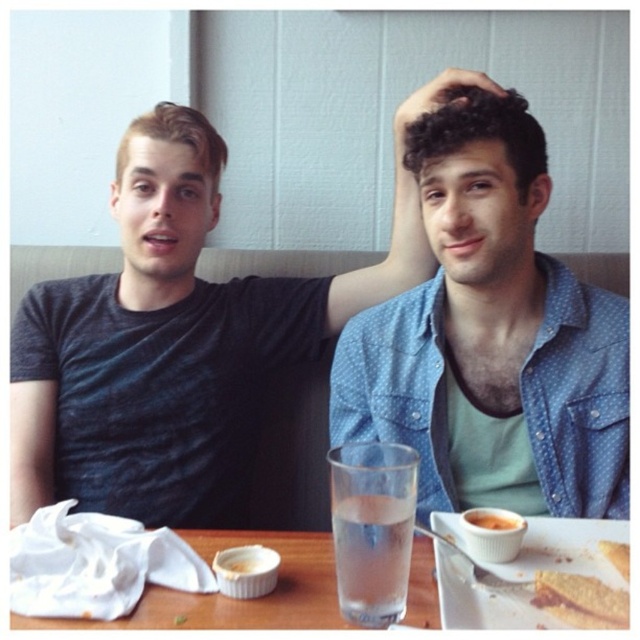
Between point (604, 586) and point (620, 561), which one is positioned in front?

Point (604, 586)

Is point (620, 592) positioned behind point (628, 550)?

No, (620, 592) is in front of (628, 550).

Does point (598, 627) lie in front of point (605, 547)?

Yes, it is.

The height and width of the screenshot is (640, 640). Identify the location of golden crumbly cake slice at lower right. (580, 600).

Can you confirm if white cloth at lower left is positioned to the right of golden crumbly cake slice at lower right?

No, white cloth at lower left is not to the right of golden crumbly cake slice at lower right.

Does white cloth at lower left appear under golden crumbly cake slice at lower right?

Yes, white cloth at lower left is below golden crumbly cake slice at lower right.

Between point (332, 609) and point (570, 620), which one is positioned behind?

The point (332, 609) is behind.

What are the coordinates of `white cloth at lower left` in the screenshot? It's located at (232, 598).

What do you see at coordinates (490, 328) in the screenshot? I see `blue dotted shirt at upper right` at bounding box center [490, 328].

Is the position of blue dotted shirt at upper right less distant than that of white cloth at lower left?

No, blue dotted shirt at upper right is further to the viewer.

Which is in front, point (497, 333) or point (307, 564)?

Positioned in front is point (307, 564).

Where is `blue dotted shirt at upper right`? The height and width of the screenshot is (640, 640). blue dotted shirt at upper right is located at coordinates (490, 328).